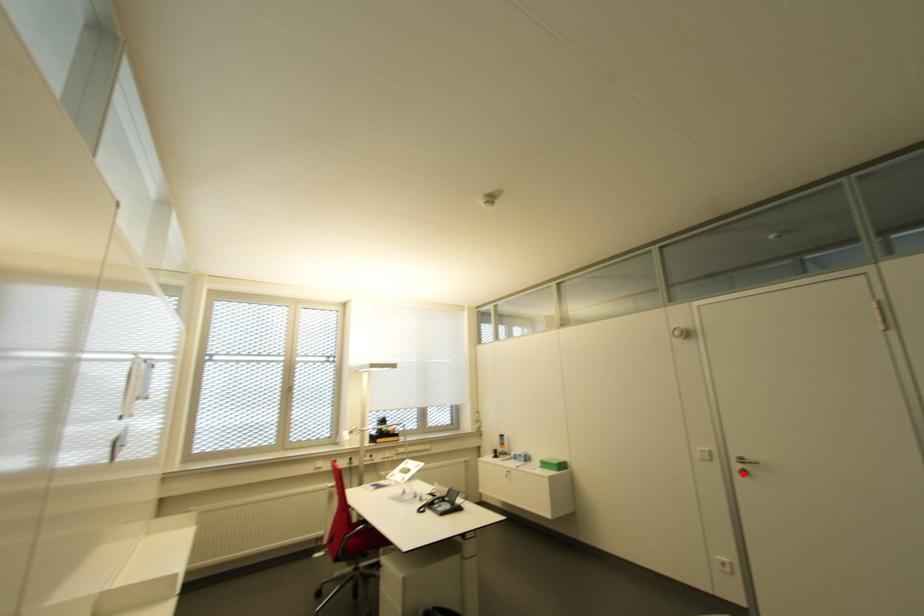
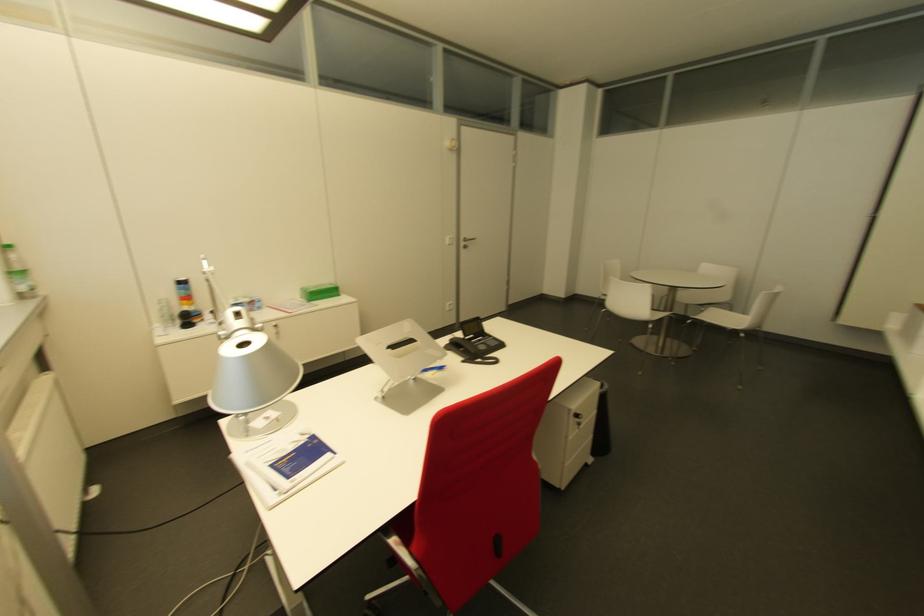
Where in the second image is the point corresponding to the highlighted location from the first image?

(463, 246)